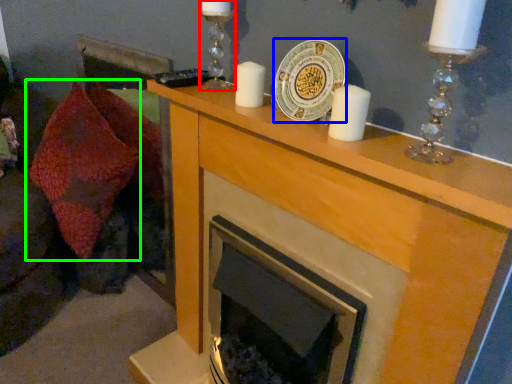
Question: Estimate the real-world distances between objects in this image. Which object is closer to candle holder (highlighted by a red box), platter (highlighted by a blue box) or throw pillow (highlighted by a green box)?

Choices:
 (A) platter
 (B) throw pillow

Answer: (A)